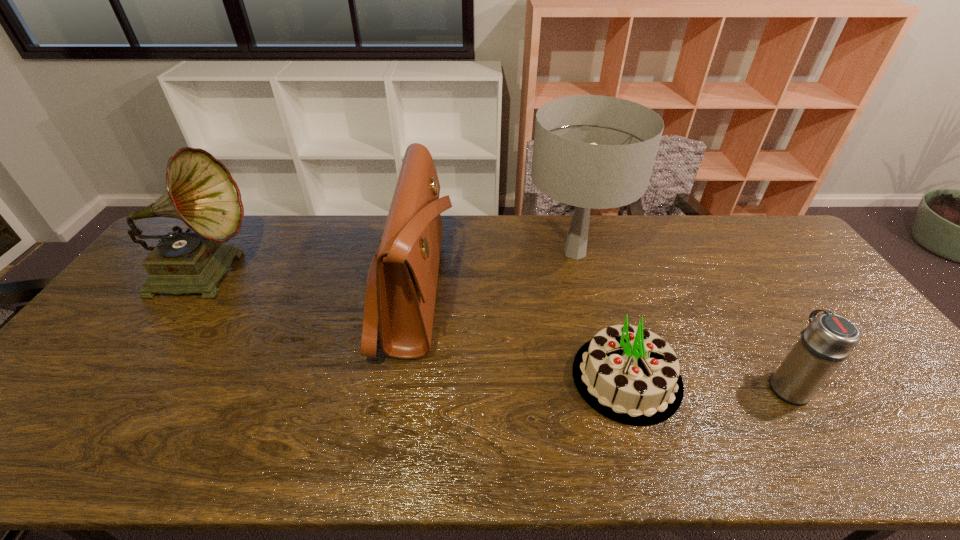
Find the location of a particular element. This screenshot has height=540, width=960. object that can be found as the second closest to the lampshade is located at coordinates (401, 286).

Identify the location of object identified as the closest to the lampshade. (x=628, y=374).

The image size is (960, 540). Find the location of `free space that satisfies the following two spatial constraints: 1. on the front-facing side of the lampshade; 2. on the left side of the shortest object`. free space that satisfies the following two spatial constraints: 1. on the front-facing side of the lampshade; 2. on the left side of the shortest object is located at coordinates (607, 377).

The width and height of the screenshot is (960, 540). What are the coordinates of `free space that satisfies the following two spatial constraints: 1. on the front-facing side of the lampshade; 2. on the left side of the birthday cake` in the screenshot? It's located at (607, 377).

Image resolution: width=960 pixels, height=540 pixels. In order to click on free space in the image that satisfies the following two spatial constraints: 1. with a handle on the side of the thermos bottle; 2. on the front flap of the satchel in this screenshot , I will do `click(729, 290)`.

What are the coordinates of `blank space that satisfies the following two spatial constraints: 1. on the front-facing side of the lampshade; 2. on the front flap of the second object from left to right` in the screenshot? It's located at (585, 290).

Image resolution: width=960 pixels, height=540 pixels. I want to click on vacant space that satisfies the following two spatial constraints: 1. on the front flap of the fourth object from right to left; 2. on the left side of the birthday cake, so (398, 377).

What are the coordinates of `vacant region that satisfies the following two spatial constraints: 1. on the front-facing side of the lampshade; 2. on the front flap of the fourth object from right to left` in the screenshot? It's located at (585, 290).

Image resolution: width=960 pixels, height=540 pixels. Identify the location of free space that satisfies the following two spatial constraints: 1. from the horn of the record player; 2. with a handle on the side of the fourth tallest object. (125, 386).

Locate an element on the screen. This screenshot has height=540, width=960. vacant space that satisfies the following two spatial constraints: 1. from the horn of the leftmost object; 2. with a handle on the side of the fourth tallest object is located at coordinates (125, 386).